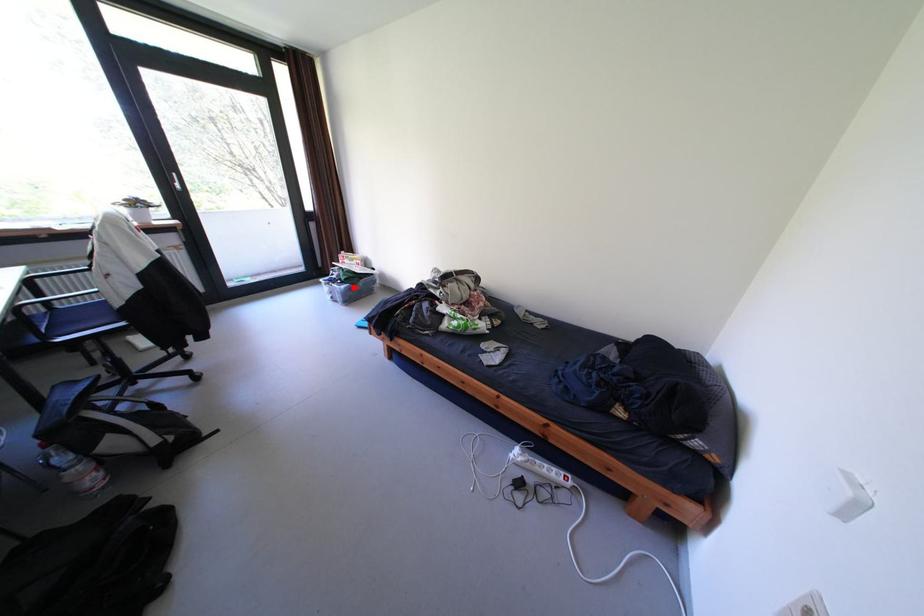
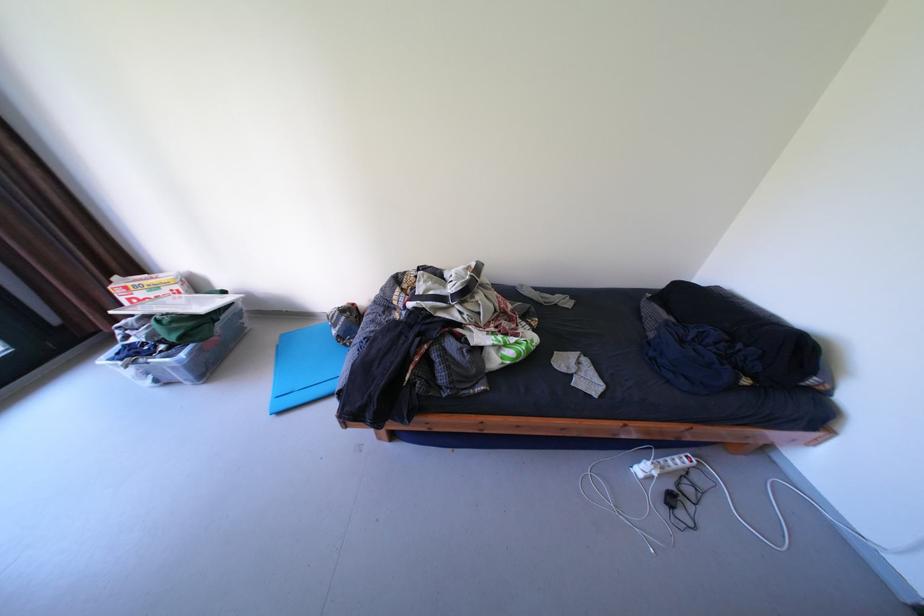
The point at the highlighted location is marked in the first image. Where is the corresponding point in the second image?

(193, 355)